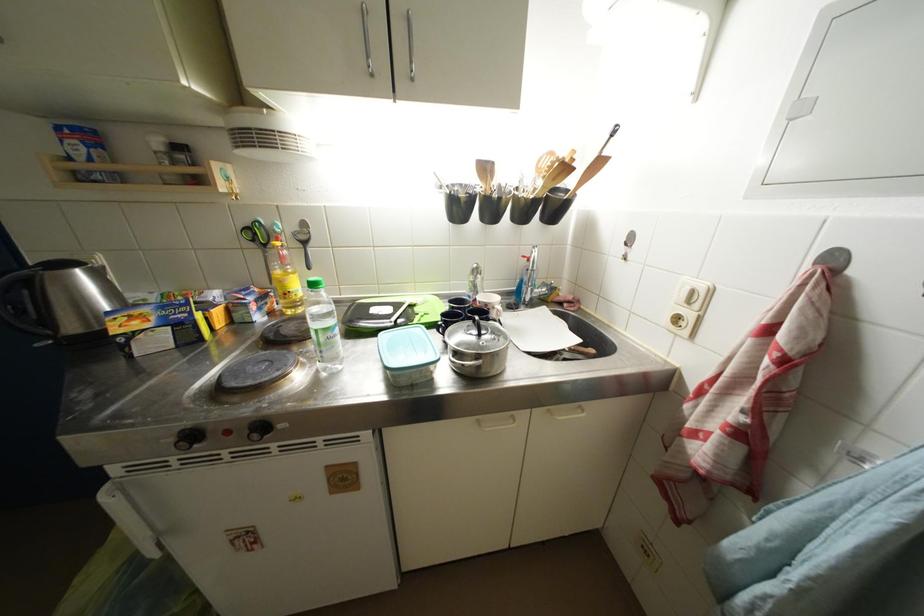
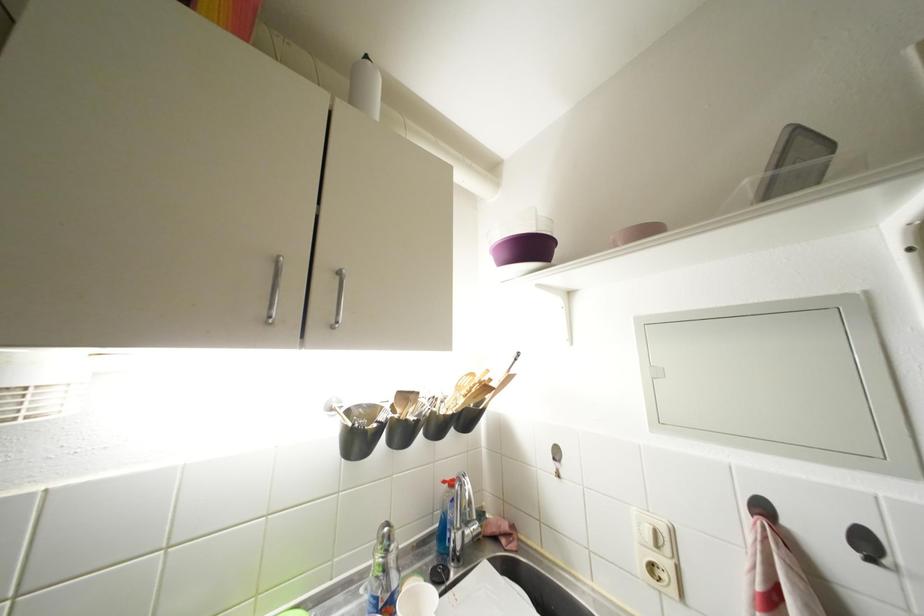
The images are taken continuously from a first-person perspective. In which direction is your viewpoint rotating?

The camera's rotation is toward right-up.